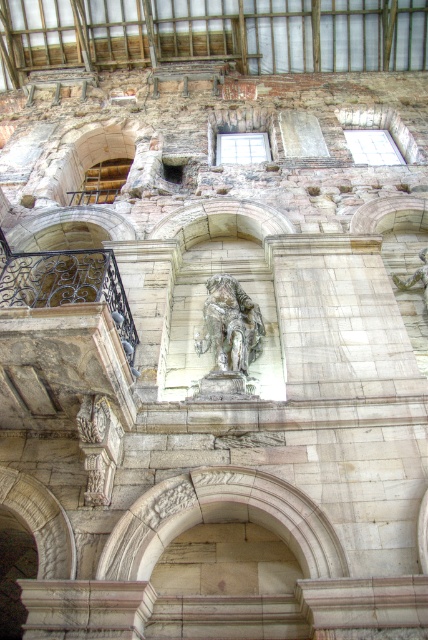
Consider the image. You are an art conservator assessing the space. You need to determine which statue, the bronze statue at center or the green mossy stone statue at center, requires immediate attention based on their widths. According to the description, which one is wider?

The bronze statue at center might be wider than the green mossy stone statue at center, so the bronze statue at center may require immediate attention due to its potential width causing structural concerns.

You are an architect examining the old stone building. You notice the stone archway at center and the bronze statue at center. Which object is located to the left of the other?

The stone archway at center is positioned on the left side of bronze statue at center.